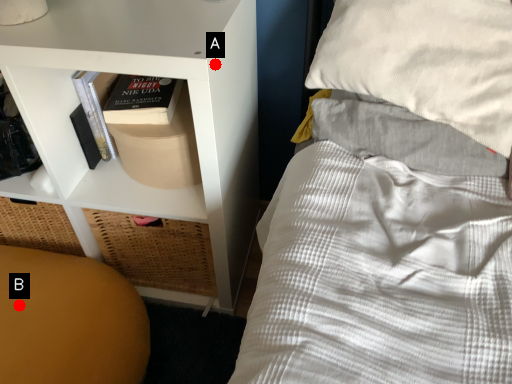
Question: Two points are circled on the image, labeled by A and B beside each circle. Which of the following is the farthest from the observer?

Choices:
 (A) A is further
 (B) B is further

Answer: (B)